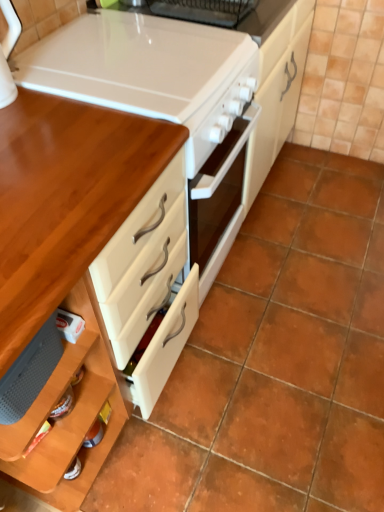
Find the location of a particular element. free space above white glossy stove at upper center (from a real-world perspective) is located at coordinates (134, 49).